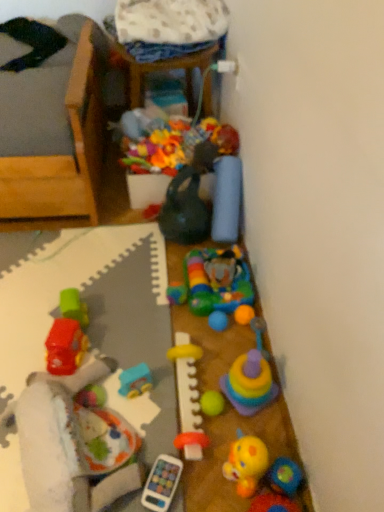
Locate an element on the screen. This screenshot has width=384, height=512. free spot to the left of orange rubber ball at center-right, marked as the second toy in a right-to-left arrangement is located at coordinates (188, 328).